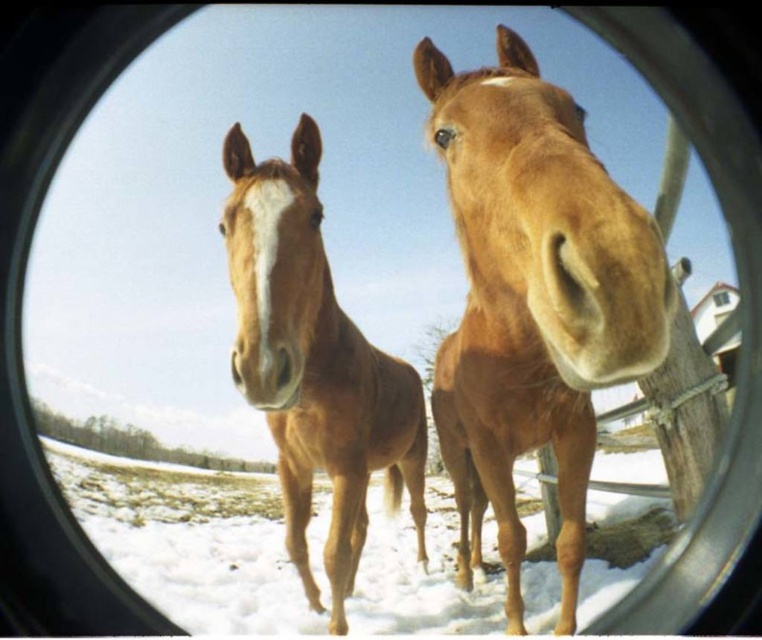
Is point (452, 480) farther from camera compared to point (231, 138)?

Yes, it is.

Can you confirm if brown matte horse at center is bigger than brown glossy horse at center?

Actually, brown matte horse at center might be smaller than brown glossy horse at center.

Is point (572, 157) closer to viewer compared to point (328, 364)?

Yes.

This screenshot has height=640, width=762. I want to click on brown matte horse at center, so pyautogui.click(x=533, y=300).